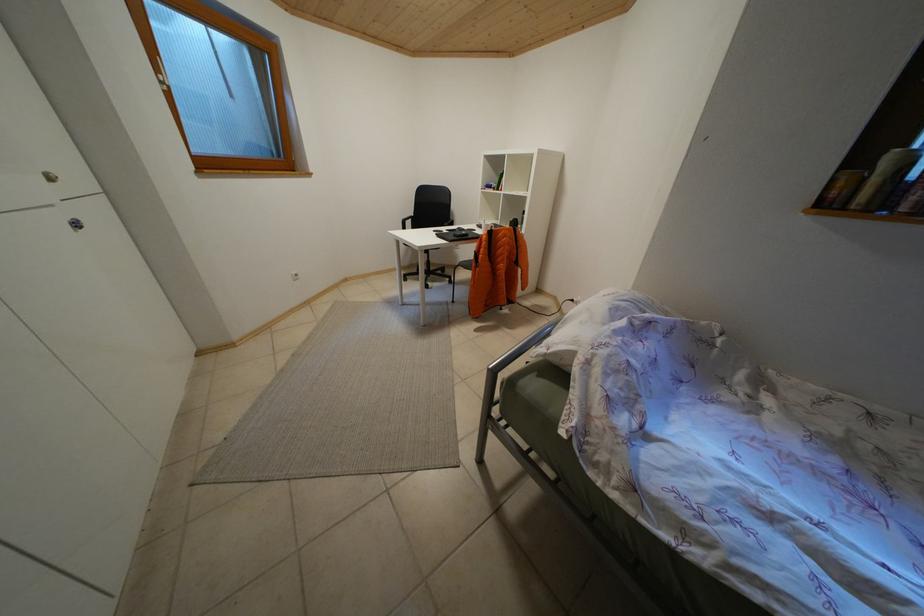
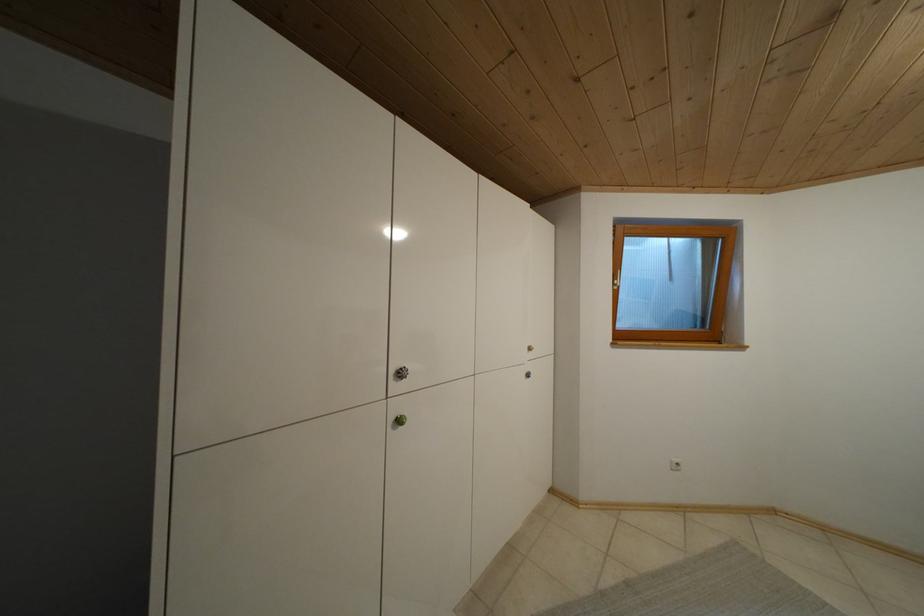
Question: The camera is either moving clockwise (left) or counter-clockwise (right) around the object. The first image is from the beginning of the video and the second image is from the end. Is the camera moving left or right when shooting the video?

Choices:
 (A) Left
 (B) Right

Answer: (B)